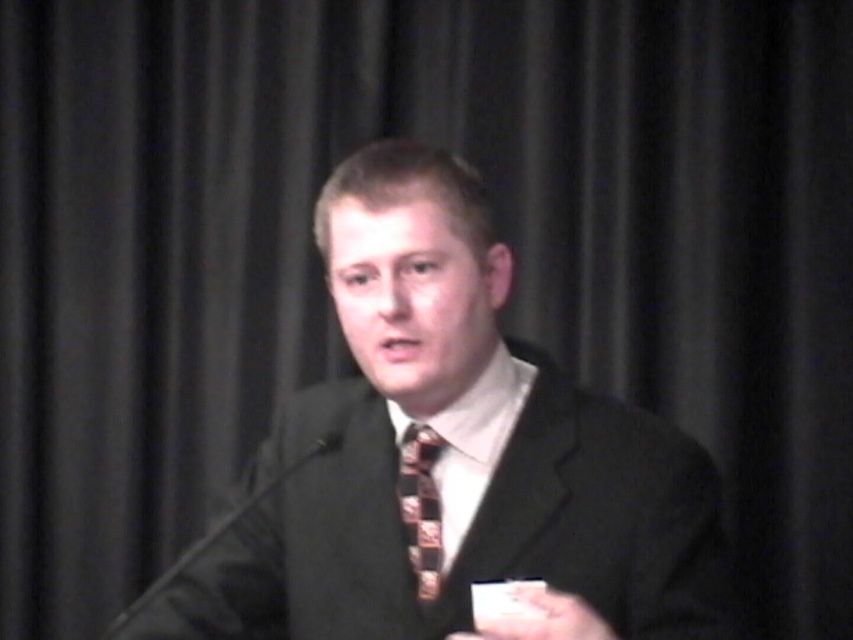
Is patterned silk tie at center further to the viewer compared to smooth white paper at center?

Yes, it is behind smooth white paper at center.

Can you confirm if patterned silk tie at center is positioned to the left of smooth white paper at center?

Indeed, patterned silk tie at center is positioned on the left side of smooth white paper at center.

The width and height of the screenshot is (853, 640). I want to click on patterned silk tie at center, so click(421, 506).

Is matte black suit at center wider than smooth white paper at center?

Correct, the width of matte black suit at center exceeds that of smooth white paper at center.

You are a GUI agent. You are given a task and a screenshot of the screen. Output one action in this format:
    pyautogui.click(x=<x>, y=<y>)
    Task: Click on the matte black suit at center
    This screenshot has height=640, width=853.
    Given the screenshot: What is the action you would take?
    pyautogui.click(x=445, y=452)

The width and height of the screenshot is (853, 640). I want to click on matte black suit at center, so click(445, 452).

Is matte black suit at center to the left of patterned silk tie at center from the viewer's perspective?

No, matte black suit at center is not to the left of patterned silk tie at center.

What do you see at coordinates (445, 452) in the screenshot?
I see `matte black suit at center` at bounding box center [445, 452].

In order to click on matte black suit at center in this screenshot , I will do `click(445, 452)`.